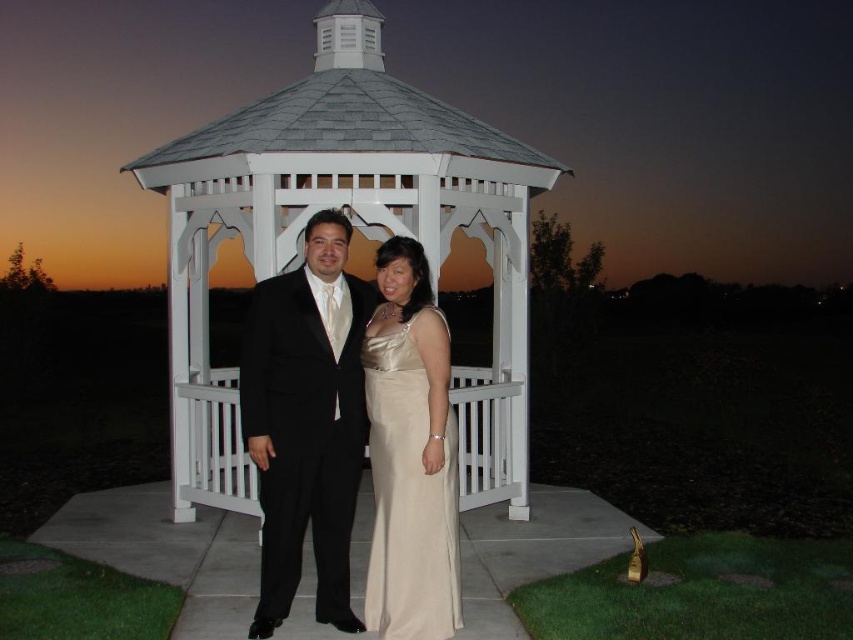
You are standing at the point marked as point (375, 232) and want to walk towards the gazebo in the image. Given that the gazebo is 26.11 feet away from you, can you estimate whether you will reach it within 10 seconds if you walk at a normal pace of 3 feet per second?

The distance between you and the gazebo is 26.11 feet. At a normal walking speed of 3 feet per second, it would take approximately 8.7 seconds to reach the gazebo. Therefore, you can reach it within 10 seconds.

You are a photographer setting up a camera to capture the couple in the gazebo. You have two points marked on your viewfinder at coordinates point (x=358, y=29) and point (x=364, y=378). Which point is closer to the camera?

Point (x=358, y=29) is further to the viewer than point (x=364, y=378), so the point closer to the camera is point (x=364, y=378).